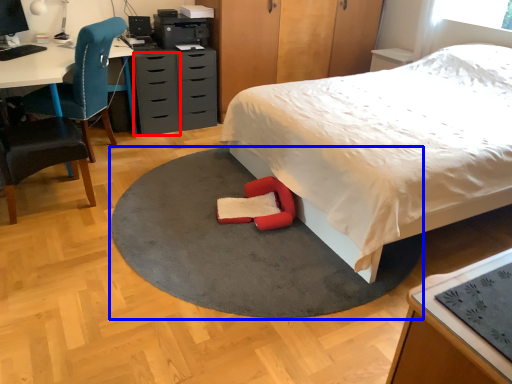
Question: Which object is closer to the camera taking this photo, drawer (highlighted by a red box) or mat (highlighted by a blue box)?

Choices:
 (A) drawer
 (B) mat

Answer: (B)